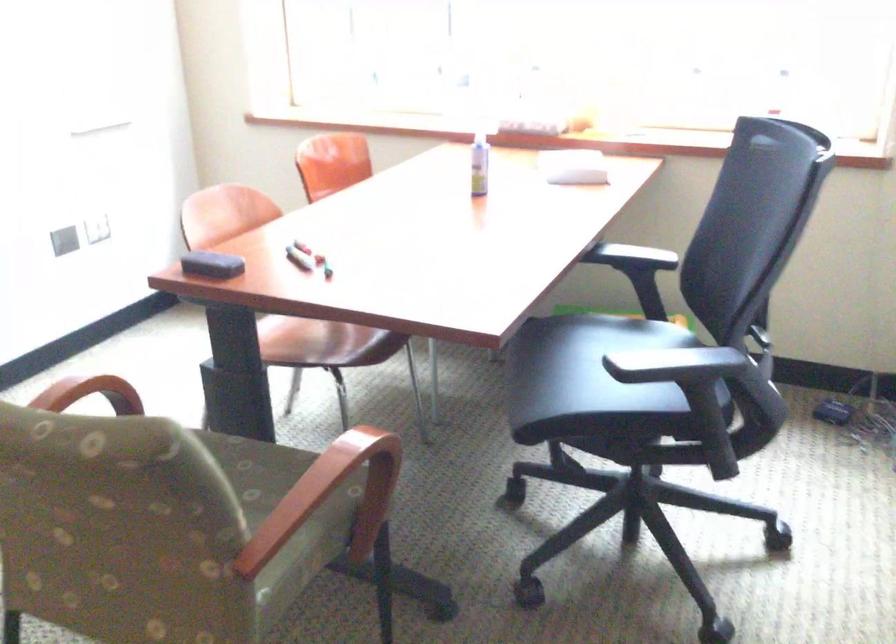
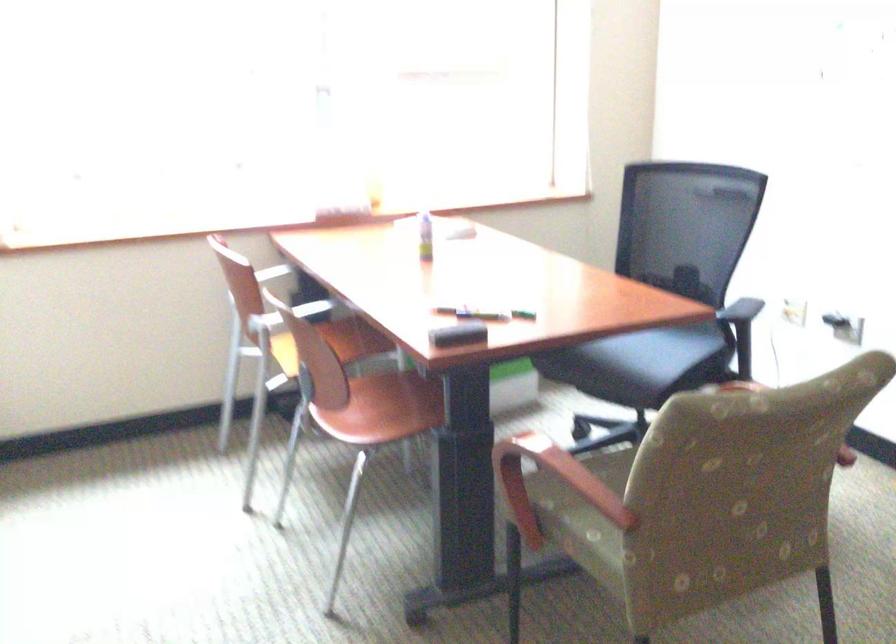
Find the pixel in the second image that matches (334,336) in the first image.

(391, 406)